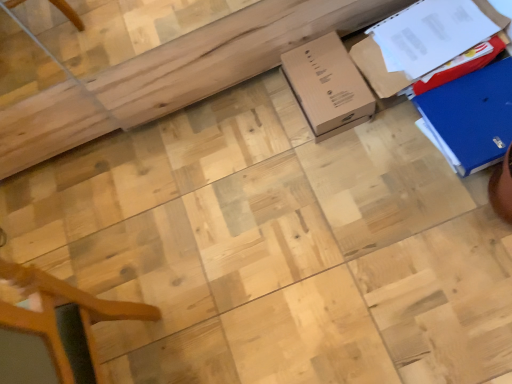
What is the approximate height of brown cardboard box at center, which appears as the 3th cardboard box when viewed from the right?

brown cardboard box at center, which appears as the 3th cardboard box when viewed from the right, is 6.39 inches tall.

Find the location of `brown cardboard box at upper right, the second cardboard box in the right-to-left sequence`. brown cardboard box at upper right, the second cardboard box in the right-to-left sequence is located at coordinates (377, 69).

Where is `blue cardboard box at right, the third cardboard box viewed from the left`? blue cardboard box at right, the third cardboard box viewed from the left is located at coordinates (471, 117).

Would you say brown cardboard box at upper right, which is the second cardboard box in left-to-right order, contains brown cardboard box at center, the 1th cardboard box positioned from the left?

That's incorrect, brown cardboard box at center, the 1th cardboard box positioned from the left, is not inside brown cardboard box at upper right, which is the second cardboard box in left-to-right order.

Is brown cardboard box at upper right, which is the second cardboard box in left-to-right order, closer to the viewer compared to brown cardboard box at center, the 1th cardboard box positioned from the left?

Yes, brown cardboard box at upper right, which is the second cardboard box in left-to-right order, is closer to the camera.

Which point is more distant from viewer, [484,0] or [365,85]?

The point [365,85] is more distant.

Could you measure the distance between brown cardboard box at upper right, which is the second cardboard box in left-to-right order, and brown cardboard box at center, which appears as the 3th cardboard box when viewed from the right?

They are 11.11 centimeters apart.

Does brown cardboard box at center, which appears as the 3th cardboard box when viewed from the right, have a lesser height compared to brown cardboard box at upper right, the second cardboard box in the right-to-left sequence?

Yes.

Is brown cardboard box at center, which appears as the 3th cardboard box when viewed from the right, positioned with its back to brown cardboard box at upper right, the second cardboard box in the right-to-left sequence?

Yes.

Could you measure the distance between brown cardboard box at center, which appears as the 3th cardboard box when viewed from the right, and brown cardboard box at upper right, the second cardboard box in the right-to-left sequence?

A distance of 11.11 centimeters exists between brown cardboard box at center, which appears as the 3th cardboard box when viewed from the right, and brown cardboard box at upper right, the second cardboard box in the right-to-left sequence.

Can you confirm if brown cardboard box at center, the 1th cardboard box positioned from the left, is positioned to the right of brown cardboard box at upper right, the second cardboard box in the right-to-left sequence?

Incorrect, brown cardboard box at center, the 1th cardboard box positioned from the left, is not on the right side of brown cardboard box at upper right, the second cardboard box in the right-to-left sequence.

Locate an element on the screen. This screenshot has width=512, height=384. cardboard box below the brown cardboard box at center, which appears as the 3th cardboard box when viewed from the right (from the image's perspective) is located at coordinates (471, 117).

Does brown cardboard box at center, the 1th cardboard box positioned from the left, have a larger size compared to blue cardboard box at right, which is the first cardboard box from right to left?

No.

From a real-world perspective, does brown cardboard box at center, the 1th cardboard box positioned from the left, stand above blue cardboard box at right, which is the first cardboard box from right to left?

Actually, brown cardboard box at center, the 1th cardboard box positioned from the left, is physically below blue cardboard box at right, which is the first cardboard box from right to left, in the real world.

From their relative heights in the image, would you say brown cardboard box at center, which appears as the 3th cardboard box when viewed from the right, is taller or shorter than blue cardboard box at right, which is the first cardboard box from right to left?

Clearly, brown cardboard box at center, which appears as the 3th cardboard box when viewed from the right, is taller compared to blue cardboard box at right, which is the first cardboard box from right to left.

Is brown cardboard box at upper right, the second cardboard box in the right-to-left sequence, positioned with its back to blue cardboard box at right, which is the first cardboard box from right to left?

brown cardboard box at upper right, the second cardboard box in the right-to-left sequence, is not turned away from blue cardboard box at right, which is the first cardboard box from right to left.

Choose the correct answer: Is brown cardboard box at upper right, which is the second cardboard box in left-to-right order, inside blue cardboard box at right, which is the first cardboard box from right to left, or outside it?

brown cardboard box at upper right, which is the second cardboard box in left-to-right order, cannot be found inside blue cardboard box at right, which is the first cardboard box from right to left.

Does brown cardboard box at upper right, the second cardboard box in the right-to-left sequence, have a greater height compared to blue cardboard box at right, which is the first cardboard box from right to left?

Correct, brown cardboard box at upper right, the second cardboard box in the right-to-left sequence, is much taller as blue cardboard box at right, which is the first cardboard box from right to left.

Which is further, (374, 85) or (494, 127)?

The point (374, 85) is more distant.

Which of these two, blue cardboard box at right, the third cardboard box viewed from the left, or brown cardboard box at upper right, which is the second cardboard box in left-to-right order, is smaller?

Smaller between the two is blue cardboard box at right, the third cardboard box viewed from the left.

Is blue cardboard box at right, the third cardboard box viewed from the left, not inside brown cardboard box at upper right, the second cardboard box in the right-to-left sequence?

Yes.

Between blue cardboard box at right, which is the first cardboard box from right to left, and brown cardboard box at upper right, which is the second cardboard box in left-to-right order, which one has larger width?

Wider between the two is brown cardboard box at upper right, which is the second cardboard box in left-to-right order.

Is blue cardboard box at right, the third cardboard box viewed from the left, aimed at brown cardboard box at upper right, which is the second cardboard box in left-to-right order?

No, blue cardboard box at right, the third cardboard box viewed from the left, is not oriented towards brown cardboard box at upper right, which is the second cardboard box in left-to-right order.

Is blue cardboard box at right, the third cardboard box viewed from the left, turned away from brown cardboard box at center, the 1th cardboard box positioned from the left?

No, blue cardboard box at right, the third cardboard box viewed from the left, is not facing the opposite direction of brown cardboard box at center, the 1th cardboard box positioned from the left.

Based on their sizes in the image, would you say blue cardboard box at right, which is the first cardboard box from right to left, is bigger or smaller than brown cardboard box at center, which appears as the 3th cardboard box when viewed from the right?

Considering their sizes, blue cardboard box at right, which is the first cardboard box from right to left, takes up more space than brown cardboard box at center, which appears as the 3th cardboard box when viewed from the right.

From the image's perspective, is blue cardboard box at right, which is the first cardboard box from right to left, located above or below brown cardboard box at center, the 1th cardboard box positioned from the left?

From the image's perspective, blue cardboard box at right, which is the first cardboard box from right to left, appears below brown cardboard box at center, the 1th cardboard box positioned from the left.

Is blue cardboard box at right, the third cardboard box viewed from the left, in front of or behind brown cardboard box at center, which appears as the 3th cardboard box when viewed from the right, in the image?

blue cardboard box at right, the third cardboard box viewed from the left, is positioned closer to the viewer than brown cardboard box at center, which appears as the 3th cardboard box when viewed from the right.

At what (x,y) coordinates should I click in order to perform the action: click on cardboard box that is the 1st one when counting forward from the brown cardboard box at center, which appears as the 3th cardboard box when viewed from the right. Please return your answer as a coordinate pair (x, y). The width and height of the screenshot is (512, 384). Looking at the image, I should click on (377, 69).

I want to click on cardboard box lying behind the brown cardboard box at upper right, the second cardboard box in the right-to-left sequence, so click(x=328, y=86).

From the image, which object appears to be farther from brown cardboard box at upper right, the second cardboard box in the right-to-left sequence, brown cardboard box at center, the 1th cardboard box positioned from the left, or blue cardboard box at right, the third cardboard box viewed from the left?

The object further to brown cardboard box at upper right, the second cardboard box in the right-to-left sequence, is blue cardboard box at right, the third cardboard box viewed from the left.

When comparing their distances from blue cardboard box at right, which is the first cardboard box from right to left, does brown cardboard box at center, which appears as the 3th cardboard box when viewed from the right, or brown cardboard box at upper right, the second cardboard box in the right-to-left sequence, seem closer?

brown cardboard box at upper right, the second cardboard box in the right-to-left sequence, is positioned closer to the anchor blue cardboard box at right, which is the first cardboard box from right to left.

When comparing their distances from brown cardboard box at center, which appears as the 3th cardboard box when viewed from the right, does blue cardboard box at right, the third cardboard box viewed from the left, or brown cardboard box at upper right, the second cardboard box in the right-to-left sequence, seem closer?

The object closer to brown cardboard box at center, which appears as the 3th cardboard box when viewed from the right, is brown cardboard box at upper right, the second cardboard box in the right-to-left sequence.

Estimate the real-world distances between objects in this image. Which object is closer to brown cardboard box at center, the 1th cardboard box positioned from the left, brown cardboard box at upper right, the second cardboard box in the right-to-left sequence, or blue cardboard box at right, which is the first cardboard box from right to left?

The object closer to brown cardboard box at center, the 1th cardboard box positioned from the left, is brown cardboard box at upper right, the second cardboard box in the right-to-left sequence.

Considering their positions, is brown cardboard box at upper right, which is the second cardboard box in left-to-right order, positioned further to blue cardboard box at right, which is the first cardboard box from right to left, than brown cardboard box at center, which appears as the 3th cardboard box when viewed from the right?

Among the two, brown cardboard box at center, which appears as the 3th cardboard box when viewed from the right, is located further to blue cardboard box at right, which is the first cardboard box from right to left.

From the image, which object appears to be nearer to brown cardboard box at upper right, the second cardboard box in the right-to-left sequence, blue cardboard box at right, which is the first cardboard box from right to left, or brown cardboard box at center, which appears as the 3th cardboard box when viewed from the right?

brown cardboard box at center, which appears as the 3th cardboard box when viewed from the right, is positioned closer to the anchor brown cardboard box at upper right, the second cardboard box in the right-to-left sequence.

Identify the location of cardboard box between brown cardboard box at center, the 1th cardboard box positioned from the left, and blue cardboard box at right, which is the first cardboard box from right to left. (377, 69).